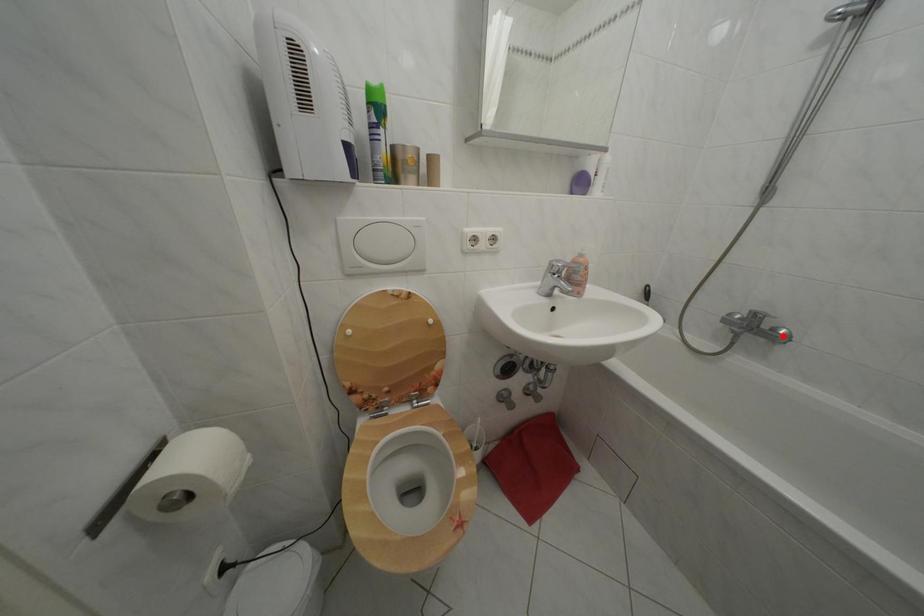
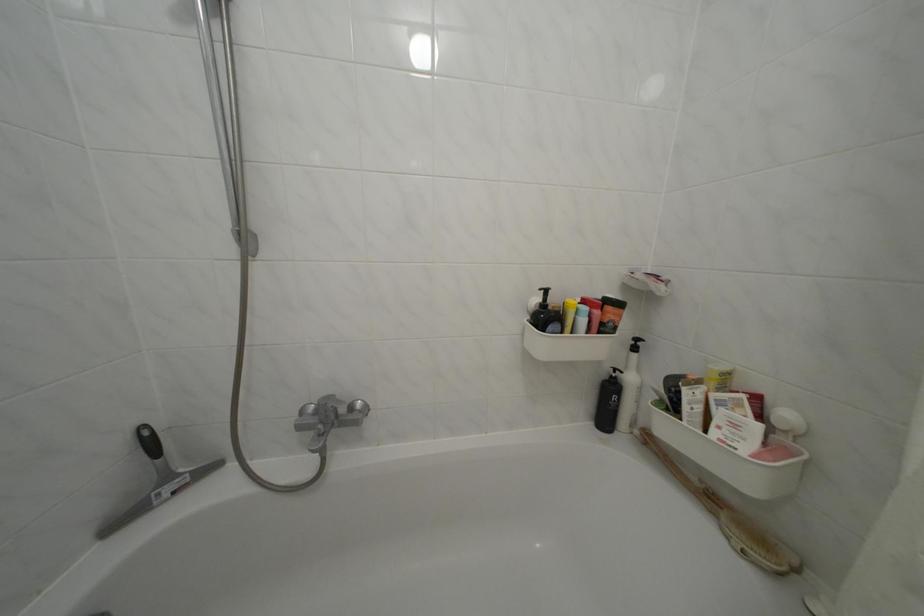
The point at the highlighted location is marked in the first image. Where is the corresponding point in the second image?

(359, 414)